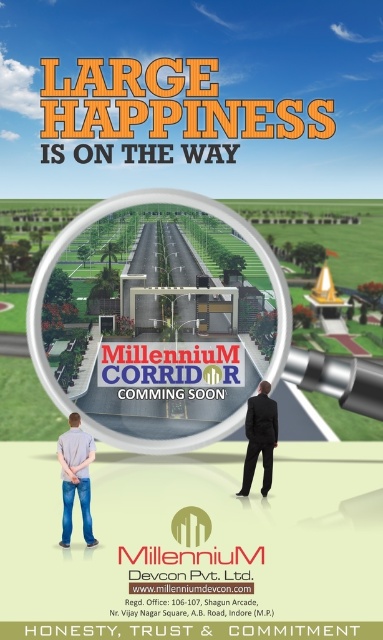
Between transparent glass magnifying glass at center and black suit at center, which one has more height?

Standing taller between the two is transparent glass magnifying glass at center.

Between point (86, 211) and point (250, 468), which one is positioned in front?

Positioned in front is point (250, 468).

Identify the location of transparent glass magnifying glass at center. This screenshot has height=640, width=383. (139, 204).

How distant is light gray shirt at lower left from black suit at center?

light gray shirt at lower left and black suit at center are 12.33 meters apart.

Can you confirm if light gray shirt at lower left is bigger than black suit at center?

No, light gray shirt at lower left is not bigger than black suit at center.

Is point (86, 536) farther from viewer compared to point (242, 493)?

No, it is not.

Where is `light gray shirt at lower left`? light gray shirt at lower left is located at coordinates (75, 477).

Does transparent glass magnifying glass at center come behind light gray shirt at lower left?

Yes, transparent glass magnifying glass at center is behind light gray shirt at lower left.

Measure the distance between point (268, 268) and camera.

Point (268, 268) and camera are 32.58 meters apart.

Which is in front, point (281, 296) or point (72, 452)?

Point (72, 452)

The height and width of the screenshot is (640, 383). Find the location of `transparent glass magnifying glass at center`. transparent glass magnifying glass at center is located at coordinates (139, 204).